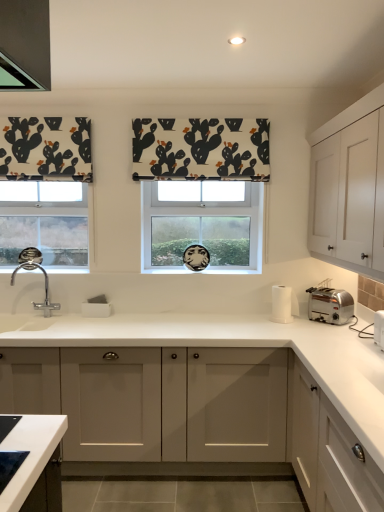
The image size is (384, 512). Find the location of `vacant space underneath white fabric with cactus print at center (from a real-world perspective)`. vacant space underneath white fabric with cactus print at center (from a real-world perspective) is located at coordinates (191, 313).